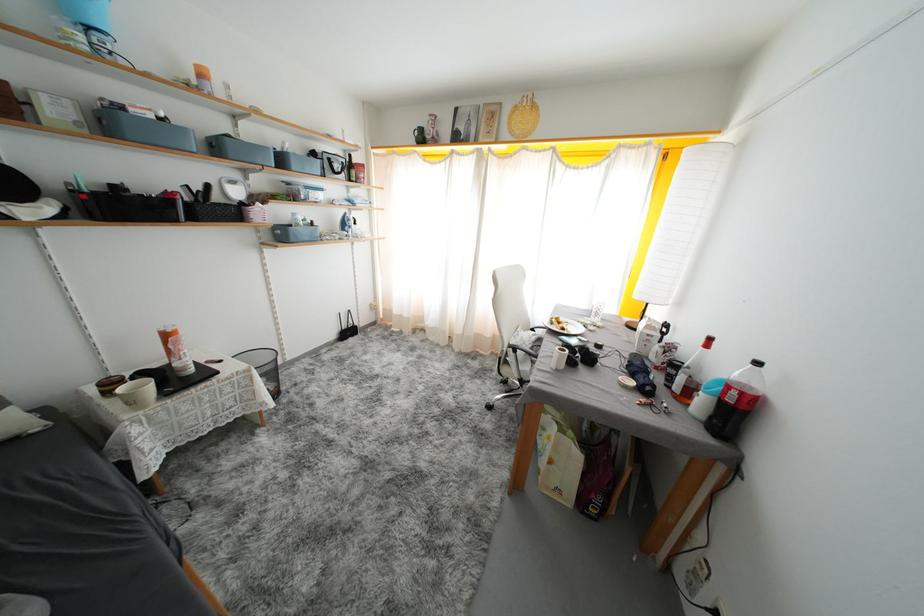
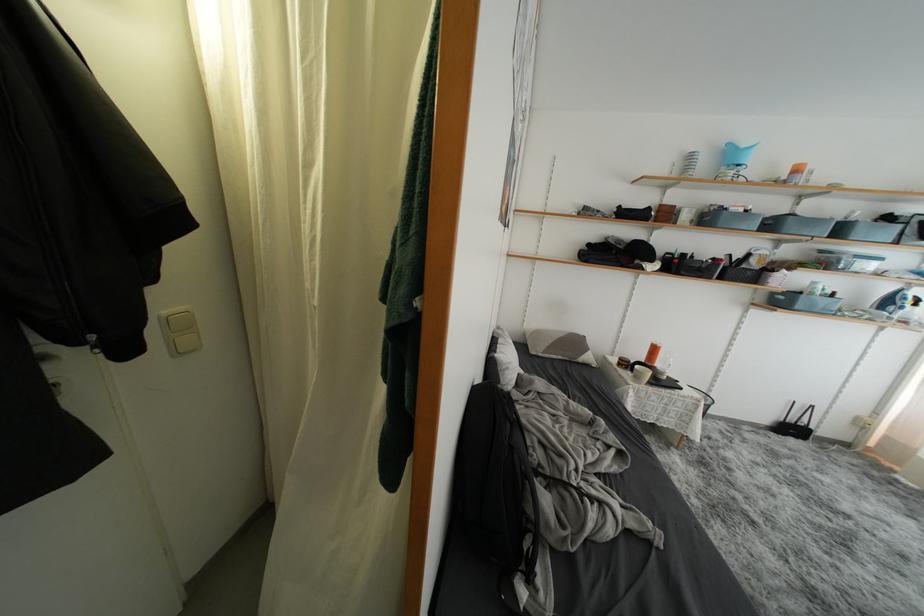
Where in the second image is the point corresponding to the point at 274,241 from the first image?

(767, 304)